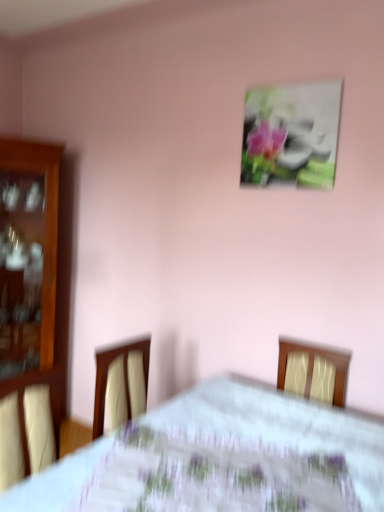
Where is `empty space that is ontop of white floral tablecloth at center`? empty space that is ontop of white floral tablecloth at center is located at coordinates (239, 444).